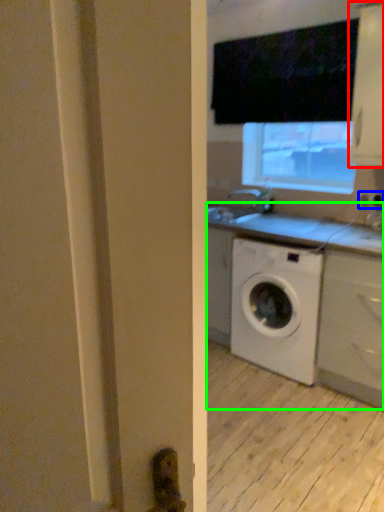
Question: Which is farther away from cabinetry (highlighted by a red box)? electric outlet (highlighted by a blue box) or counter (highlighted by a green box)?

Choices:
 (A) electric outlet
 (B) counter

Answer: (B)